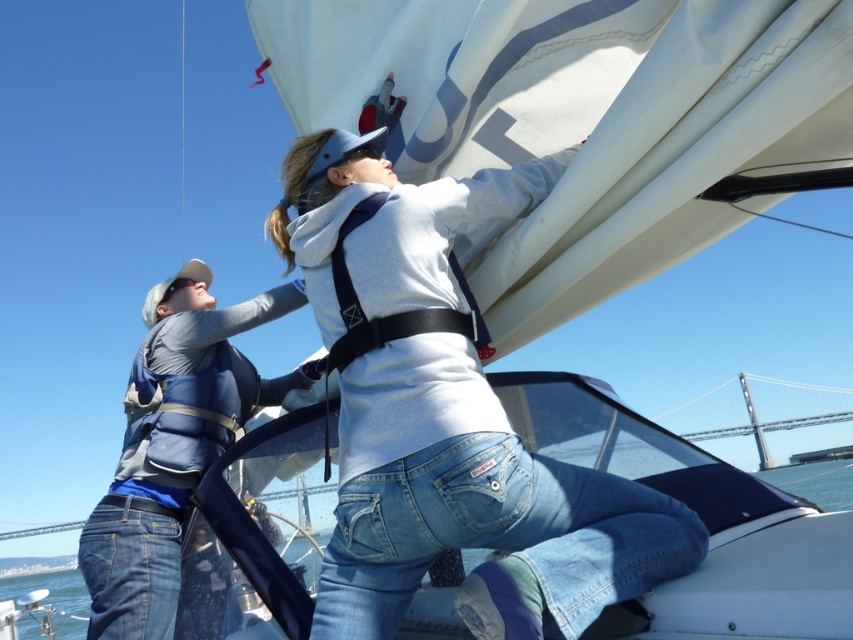
Question: Estimate the real-world distances between objects in this image. Which object is closer to the metallic gray bridge at upper right?

Choices:
 (A) blue denim jeans at lower center
 (B) blue fabric life vest at left

Answer: (B)

Question: Can you confirm if matte gray hoodie at center is positioned below blue fabric life vest at left?

Choices:
 (A) yes
 (B) no

Answer: (B)

Question: Which point appears closest to the camera in this image?

Choices:
 (A) pyautogui.click(x=524, y=480)
 (B) pyautogui.click(x=811, y=420)
 (C) pyautogui.click(x=299, y=412)
 (D) pyautogui.click(x=231, y=355)

Answer: (A)

Question: Which point is farther from the camera taking this photo?

Choices:
 (A) (476, 508)
 (B) (689, 444)
 (C) (850, 416)

Answer: (C)

Question: Is matte gray hoodie at center positioned in front of blue fabric life vest at left?

Choices:
 (A) yes
 (B) no

Answer: (A)

Question: Is the position of blue fabric life vest at left more distant than that of metallic gray bridge at upper right?

Choices:
 (A) yes
 (B) no

Answer: (B)